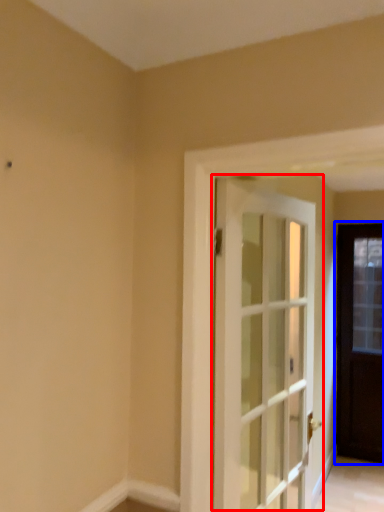
Question: Which of the following is the farthest to the observer, door (highlighted by a red box) or door (highlighted by a blue box)?

Choices:
 (A) door
 (B) door

Answer: (B)